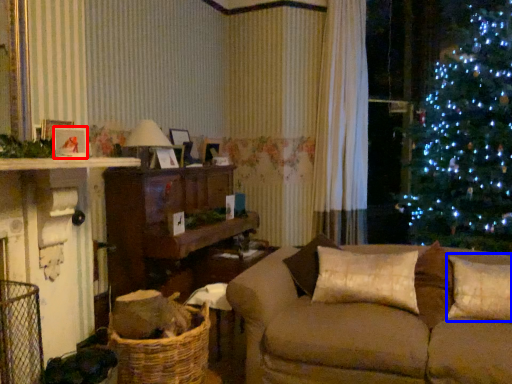
Question: Which object is closer to the camera taking this photo, picture frame (highlighted by a red box) or pillow (highlighted by a blue box)?

Choices:
 (A) picture frame
 (B) pillow

Answer: (A)